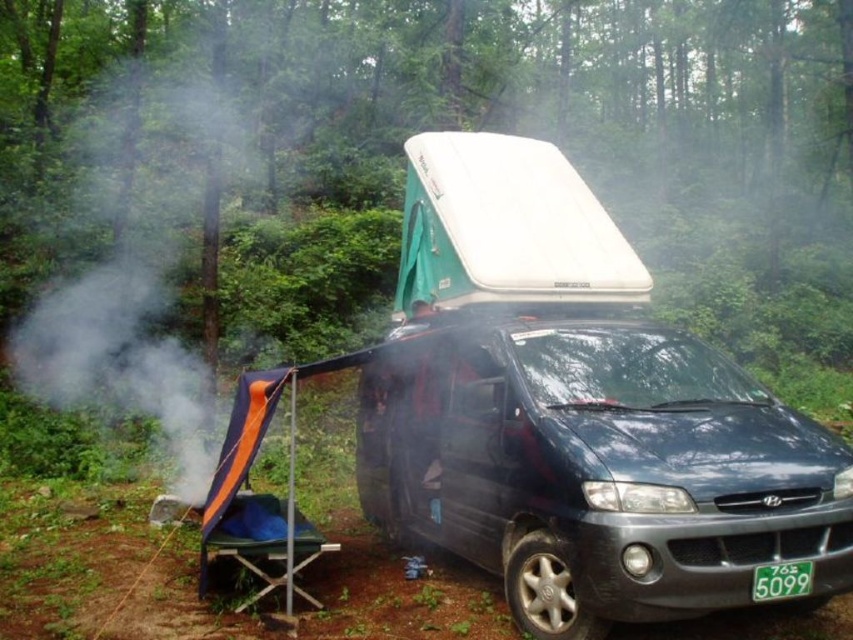
Question: Is matte black van at center thinner than green plastic license plate at lower right?

Choices:
 (A) no
 (B) yes

Answer: (A)

Question: Considering the relative positions of matte black van at center and orange fabric chair at lower left in the image provided, where is matte black van at center located with respect to orange fabric chair at lower left?

Choices:
 (A) above
 (B) below

Answer: (A)

Question: Among these objects, which one is farthest from the camera?

Choices:
 (A) white smoke at left
 (B) orange fabric chair at lower left
 (C) matte black van at center
 (D) green plastic license plate at lower right

Answer: (A)

Question: Estimate the real-world distances between objects in this image. Which object is farther from the white smoke at left?

Choices:
 (A) green plastic license plate at lower right
 (B) matte black van at center

Answer: (A)

Question: Which of the following is the farthest from the observer?

Choices:
 (A) orange fabric chair at lower left
 (B) white smoke at left
 (C) green plastic license plate at lower right

Answer: (B)

Question: Considering the relative positions of orange fabric chair at lower left and green plastic license plate at lower right in the image provided, where is orange fabric chair at lower left located with respect to green plastic license plate at lower right?

Choices:
 (A) below
 (B) above

Answer: (A)